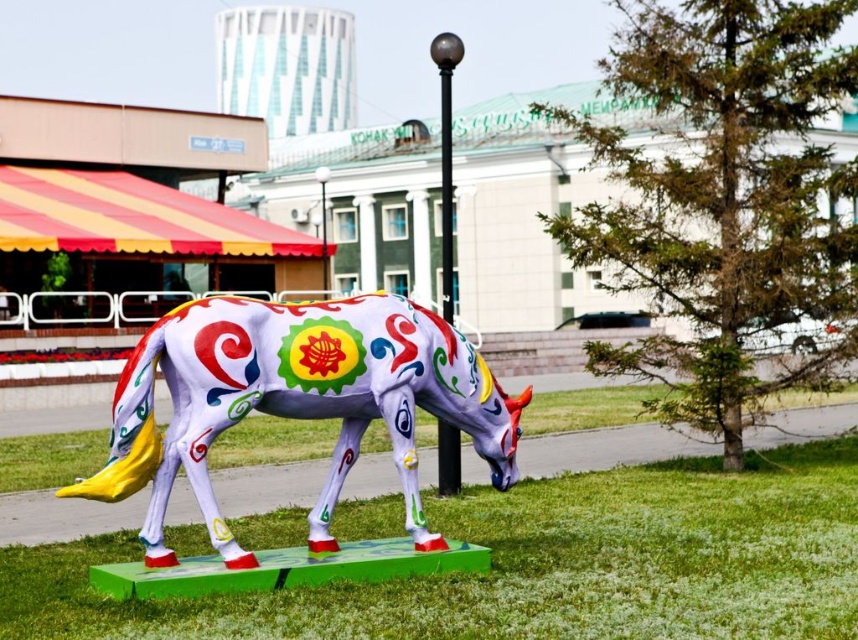
Is point (780, 593) farther from camera compared to point (144, 342)?

Yes, it is.

Is point (340, 625) positioned behind point (378, 355)?

No, (340, 625) is in front of (378, 355).

Where is `green grass at center`? green grass at center is located at coordinates (536, 564).